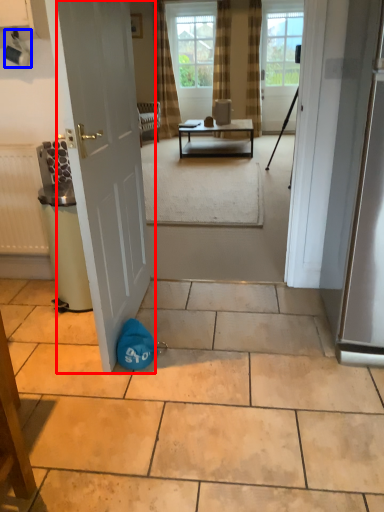
Question: Among these objects, which one is farthest to the camera, door (highlighted by a red box) or coffee cup (highlighted by a blue box)?

Choices:
 (A) door
 (B) coffee cup

Answer: (B)